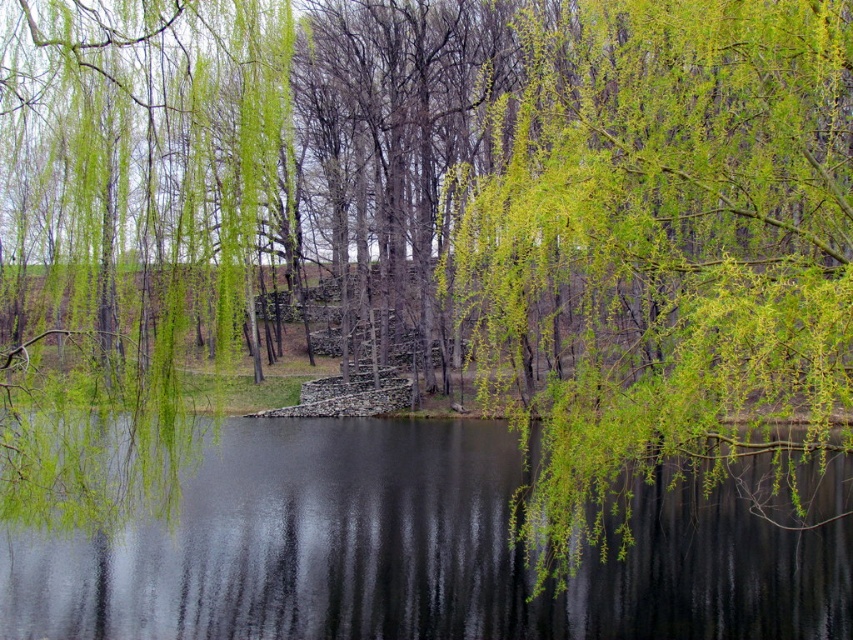
Can you confirm if green leafy willow at upper right is taller than transparent water at center?

Correct, green leafy willow at upper right is much taller as transparent water at center.

Does green leafy willow at upper right appear on the right side of transparent water at center?

Indeed, green leafy willow at upper right is positioned on the right side of transparent water at center.

The image size is (853, 640). Describe the element at coordinates (666, 250) in the screenshot. I see `green leafy willow at upper right` at that location.

I want to click on green leafy willow at upper right, so click(666, 250).

Can you confirm if transparent water at center is positioned to the left of green leafy willow at center?

In fact, transparent water at center is to the right of green leafy willow at center.

Between transparent water at center and green leafy willow at center, which one is positioned lower?

Positioned lower is transparent water at center.

In order to click on transparent water at center in this screenshot , I will do [x=412, y=552].

Which of these two, green leafy willow at upper right or green leafy willow at center, stands taller?

green leafy willow at upper right

Who is more forward, (650, 449) or (140, 448)?

Point (140, 448)

Locate an element on the screen. The width and height of the screenshot is (853, 640). green leafy willow at upper right is located at coordinates (666, 250).